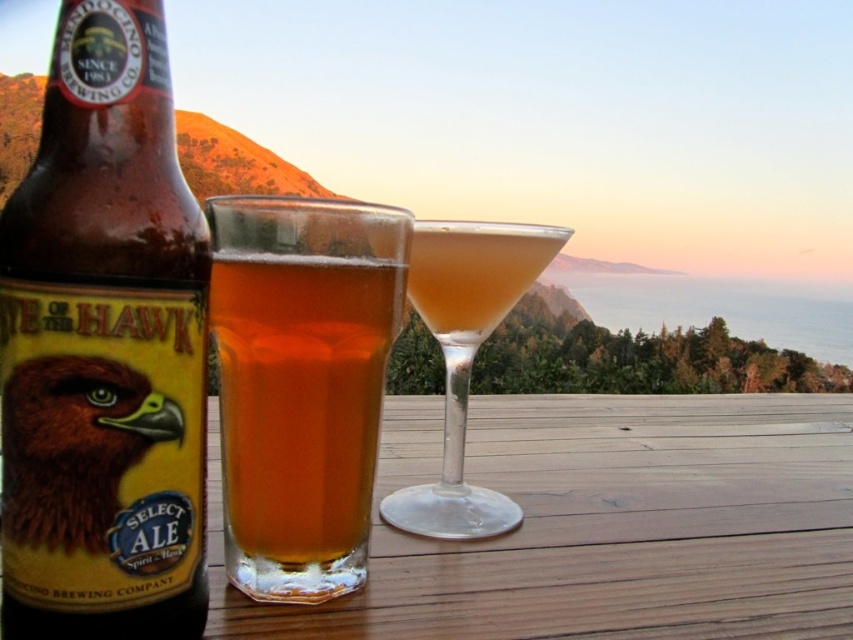
You are a bartender preparing drinks for a customer who prefers narrow containers. You see a brown glass bottle at left and a translucent glass cocktail at center on the table. Which container should you choose for their drink?

The brown glass bottle at left is thinner than the translucent glass cocktail at center, so you should choose the brown glass bottle at left for the customer who prefers narrow containers.

Looking at this image, you are at a beach bar and want to order a drink. The bartender points to the translucent glass beer at center and the translucent glass cocktail at center. Which one is smaller?

The translucent glass beer at center is smaller than the translucent glass cocktail at center.

You are standing at the camera position and want to reach the beer bottle located at point (91,547). Can you estimate how far you need to walk to reach it?

The distance between the camera and the beer bottle at point (91,547) is 5.57 inches, so you need to walk approximately 5.57 inches to reach it.